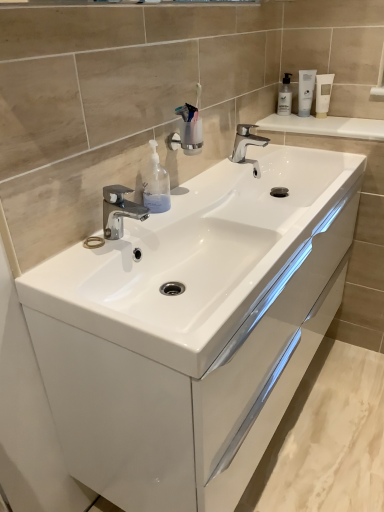
You are a GUI agent. You are given a task and a screenshot of the screen. Output one action in this format:
    pyautogui.click(x=<x>, y=<y>)
    Task: Click on the free space in front of polished chrome tap at center, the 2th tap ordered from the bottom
    The image size is (384, 512).
    Given the screenshot: What is the action you would take?
    pyautogui.click(x=237, y=176)